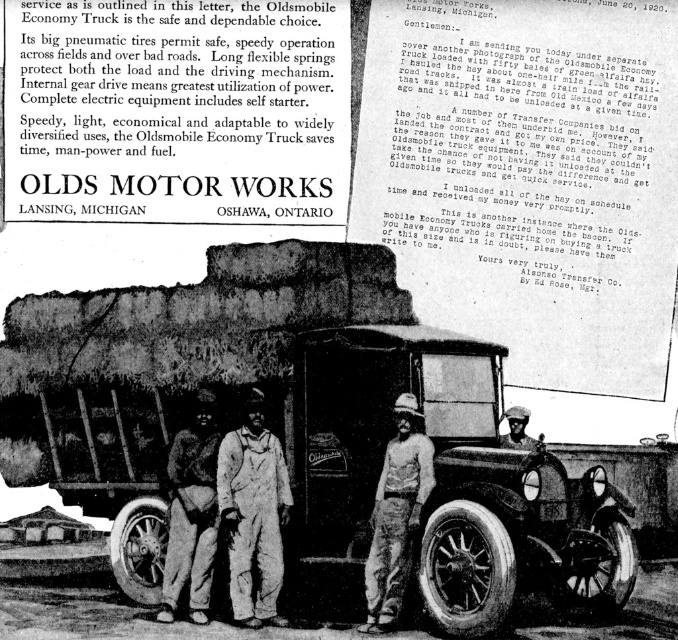
Does black rubber tire at lower right have a larger size compared to dark skin textured hat at center?

Indeed, black rubber tire at lower right has a larger size compared to dark skin textured hat at center.

Who is lower down, black rubber tire at lower right or dark skin textured hat at center?

black rubber tire at lower right

Does point (595, 518) come behind point (523, 420)?

No, (595, 518) is closer to viewer.

Where is `black rubber tire at lower right`? This screenshot has height=640, width=678. black rubber tire at lower right is located at coordinates (599, 563).

Can you confirm if overalls at center is shorter than black rubber tire at lower right?

Yes, overalls at center is shorter than black rubber tire at lower right.

Who is positioned more to the right, overalls at center or black rubber tire at lower right?

black rubber tire at lower right is more to the right.

Between point (222, 497) and point (618, 564), which one is positioned in front?

Point (222, 497)

In order to click on overalls at center in this screenshot , I will do `click(254, 513)`.

Can you confirm if light brown corduroy pants at center is wider than dark skin textured hat at center?

In fact, light brown corduroy pants at center might be narrower than dark skin textured hat at center.

Can you confirm if light brown corduroy pants at center is thinner than dark skin textured hat at center?

→ Yes.

Who is more forward, (431, 470) or (504, 436)?

Point (431, 470)

Find the location of `light brown corduroy pants at center`. light brown corduroy pants at center is located at coordinates [x=397, y=515].